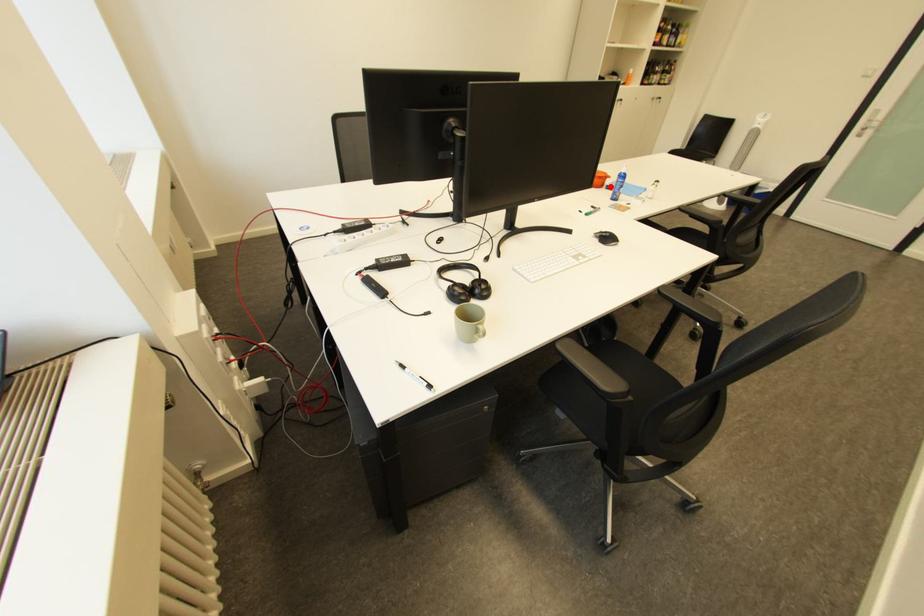
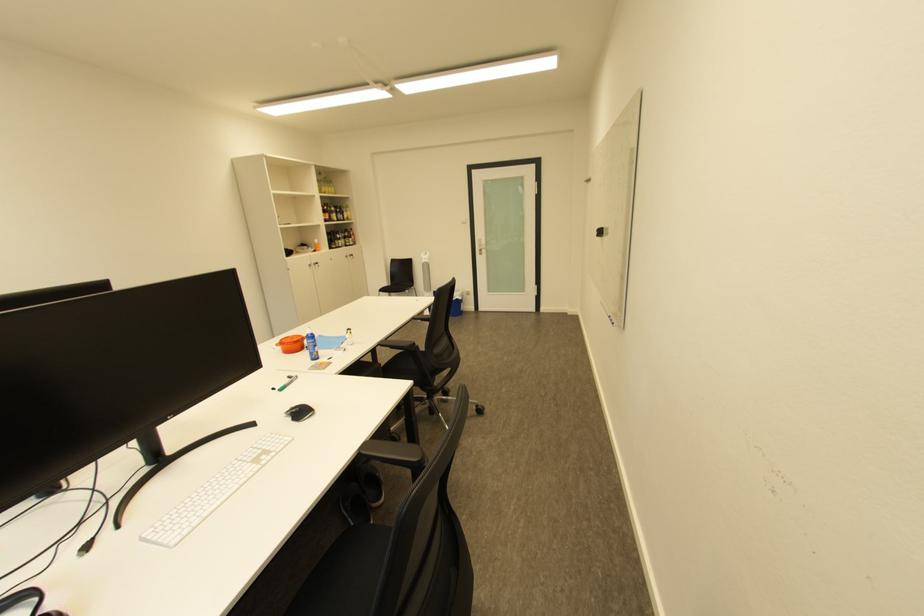
The point at the highlighted location is marked in the first image. Where is the corresponding point in the second image?

(311, 350)